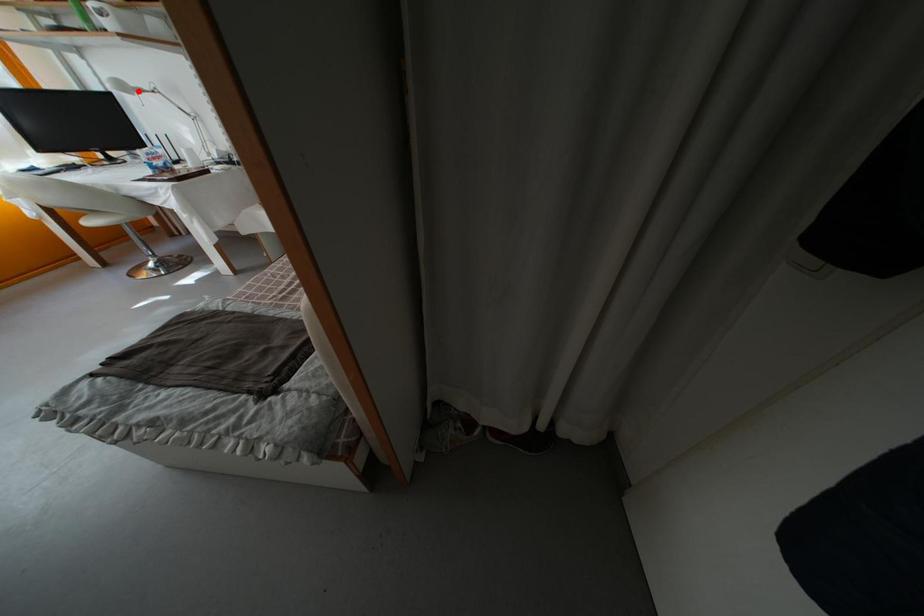
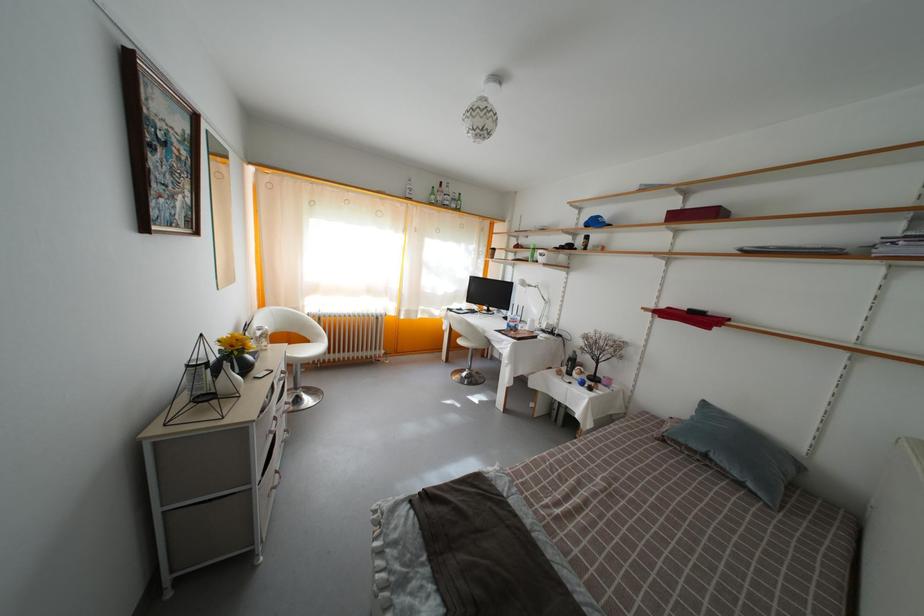
Question: A red point is marked in image1. In image2, is the corresponding 3D point closer to the camera or farther? Reply with the corresponding letter.

Choices:
 (A) The corresponding 3D point is closer.
 (B) The corresponding 3D point is farther.

Answer: (A)